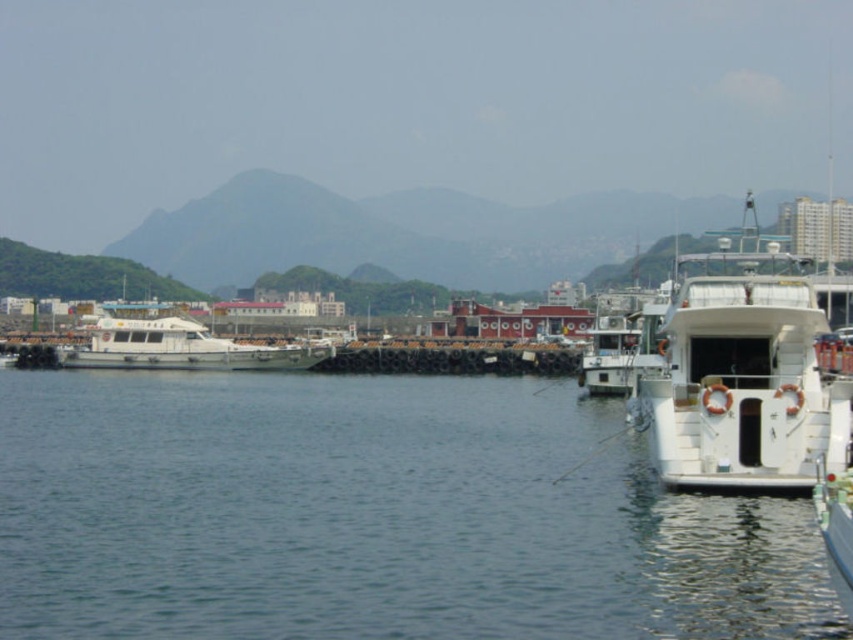
Question: Does clear water at lower left have a smaller size compared to white matte boat at left?

Choices:
 (A) no
 (B) yes

Answer: (A)

Question: Which point is farther to the camera?

Choices:
 (A) clear water at lower left
 (B) white matte boat at left

Answer: (B)

Question: Does clear water at lower left appear over white matte boat at left?

Choices:
 (A) yes
 (B) no

Answer: (B)

Question: Which point appears closest to the camera in this image?

Choices:
 (A) (548, 410)
 (B) (190, 321)

Answer: (A)

Question: Is clear water at lower left positioned in front of white matte boat at left?

Choices:
 (A) no
 (B) yes

Answer: (B)

Question: Which of the following is the closest to the observer?

Choices:
 (A) clear water at lower left
 (B) white matte boat at left

Answer: (A)